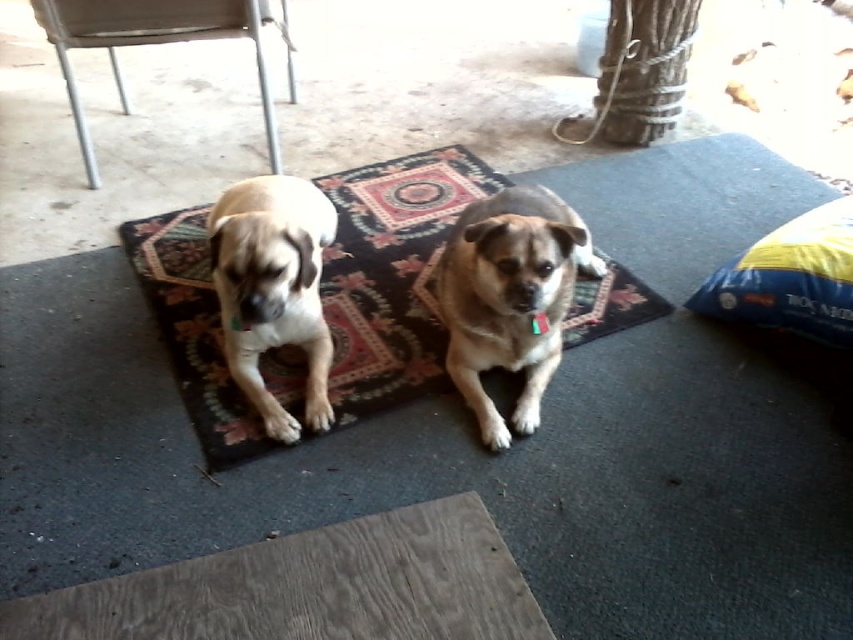
Question: Which of the following is the closest to the observer?

Choices:
 (A) brown furry dog at center
 (B) metallic silver chair at upper left
 (C) fuzzy beige dog at center
 (D) yellow fabric pillow at right

Answer: (A)

Question: Considering the relative positions of brown furry dog at center and fuzzy beige dog at center in the image provided, where is brown furry dog at center located with respect to fuzzy beige dog at center?

Choices:
 (A) right
 (B) left

Answer: (A)

Question: Which object is the closest to the patterned carpet at center?

Choices:
 (A) yellow fabric pillow at right
 (B) fuzzy beige dog at center

Answer: (B)

Question: Which point is closer to the camera?

Choices:
 (A) (370, 268)
 (B) (228, 244)

Answer: (B)

Question: Is fuzzy beige dog at center to the right of metallic silver chair at upper left from the viewer's perspective?

Choices:
 (A) no
 (B) yes

Answer: (B)

Question: Can you confirm if brown furry dog at center is positioned above fuzzy beige dog at center?

Choices:
 (A) no
 (B) yes

Answer: (A)